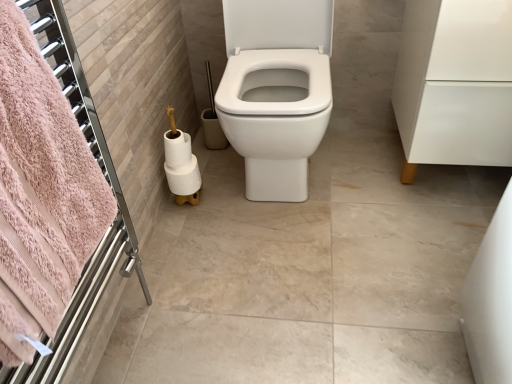
Question: In terms of height, does white glossy toilet at center look taller or shorter compared to white matte toilet paper at lower left, positioned as the 2th toilet paper in bottom-to-top order?

Choices:
 (A) short
 (B) tall

Answer: (B)

Question: In terms of width, does white glossy toilet at center look wider or thinner when compared to white matte toilet paper at lower left, positioned as the 2th toilet paper in bottom-to-top order?

Choices:
 (A) wide
 (B) thin

Answer: (A)

Question: Estimate the real-world distances between objects in this image. Which object is closer to the white matte toilet paper at lower left, positioned as the third toilet paper in bottom-to-top order?

Choices:
 (A) pink terry cloth towel at left
 (B) white matte toilet paper at lower left, positioned as the 2th toilet paper in bottom-to-top order
 (C) white glossy toilet at center
 (D) white glossy cabinet at right
 (E) white matte toilet paper at lower left, which is the first toilet paper in bottom-to-top order

Answer: (B)

Question: Which is farther from the white glossy toilet at center?

Choices:
 (A) white matte toilet paper at lower left, positioned as the 2th toilet paper in bottom-to-top order
 (B) white glossy cabinet at right
 (C) white matte toilet paper at lower left, which is the first toilet paper in bottom-to-top order
 (D) white matte toilet paper at lower left, positioned as the third toilet paper in bottom-to-top order
 (E) pink terry cloth towel at left

Answer: (E)